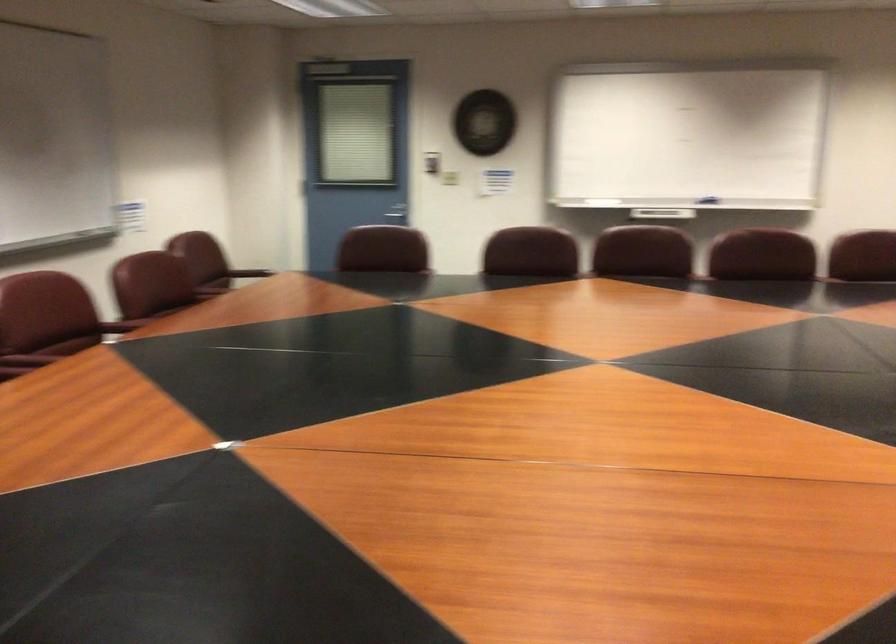
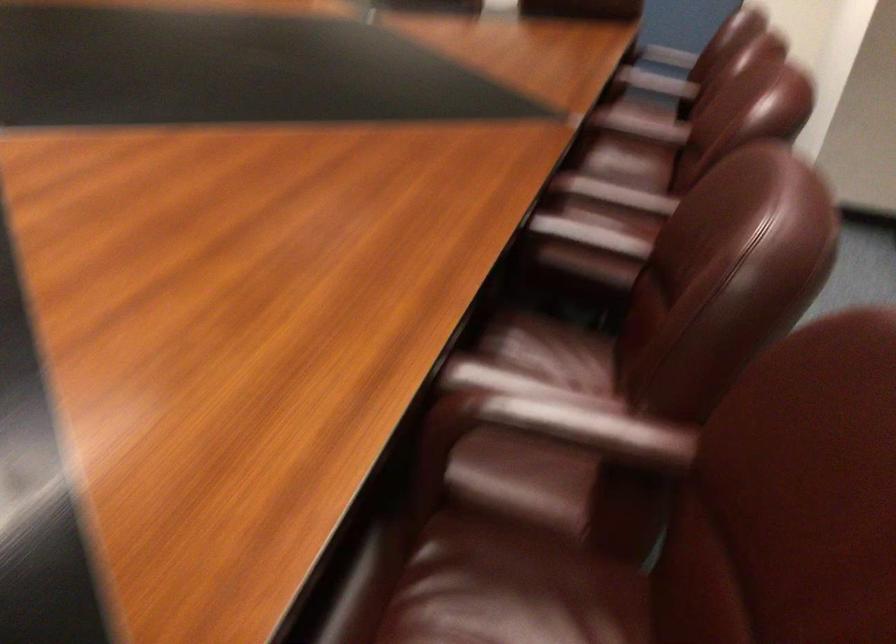
In the second image, find the point that corresponds to the point at 208,270 in the first image.

(579, 428)